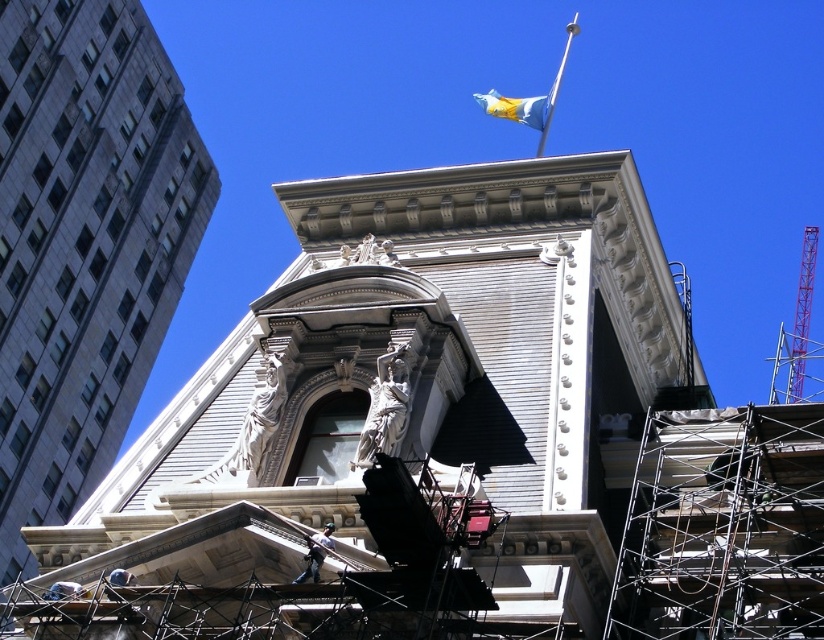
Based on the scene description, can you determine if the smooth gray stone tower at center is wider than the blue fabric flag at upper center?

The smooth gray stone tower at center might be wider than blue fabric flag at upper center according to the description.

You are an architect reviewing blueprints and notice the gray stone building at upper left in the image. What are the coordinates of its position?

The gray stone building at upper left is located at coordinates point (83, 243).